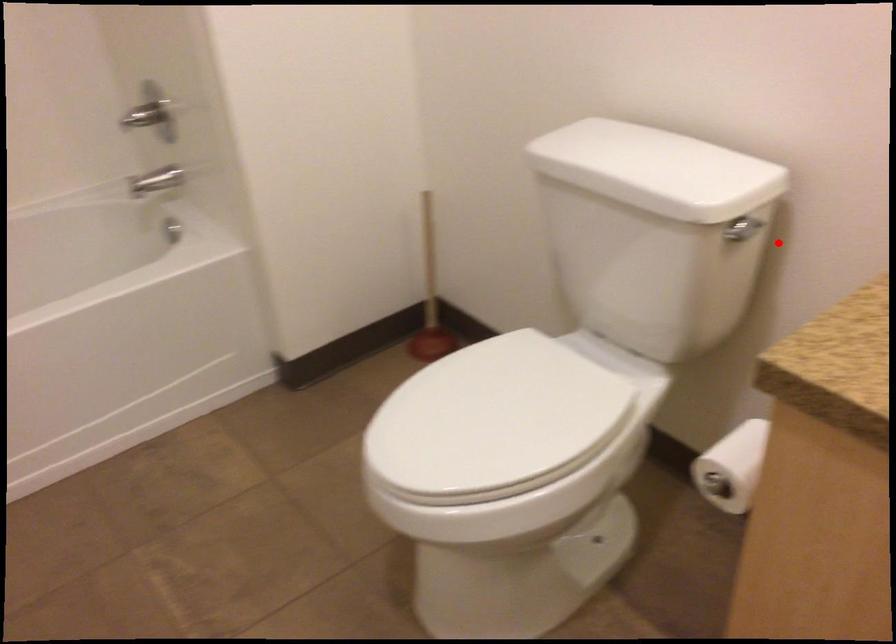
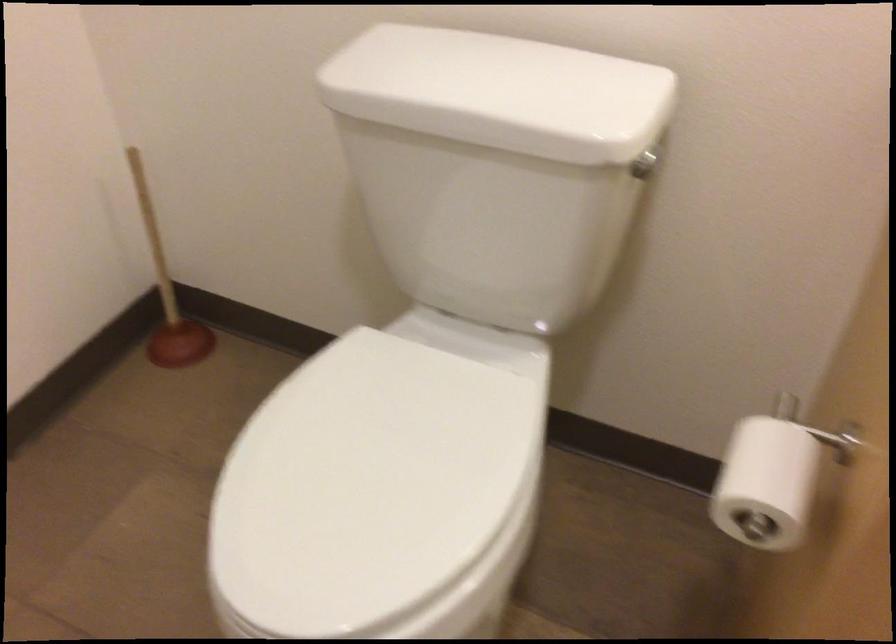
The point at the highlighted location is marked in the first image. Where is the corresponding point in the second image?

(643, 165)